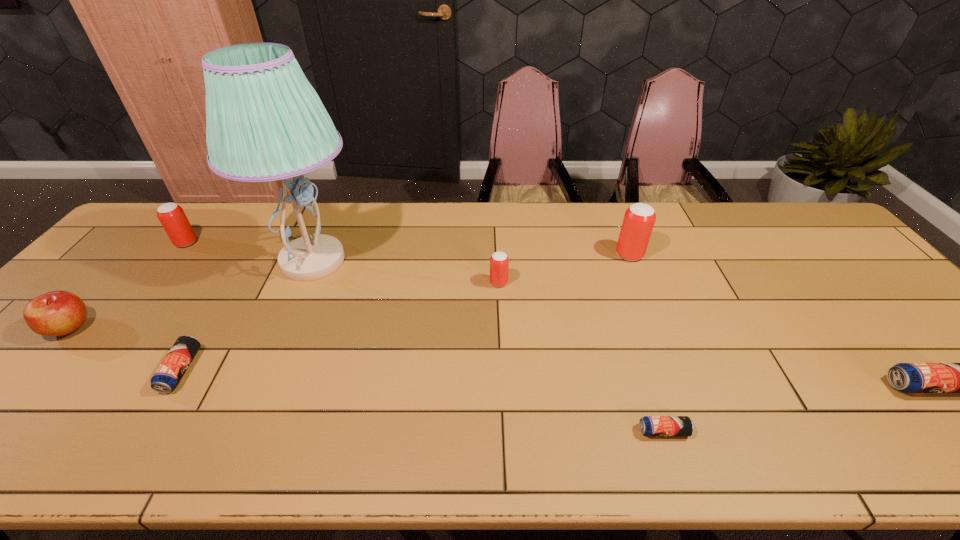
Where is `the second beer can from left to right`? This screenshot has width=960, height=540. the second beer can from left to right is located at coordinates (168, 375).

The width and height of the screenshot is (960, 540). I want to click on the leftmost blue beer can, so point(168,375).

Where is `the nearest object`? the nearest object is located at coordinates (649, 425).

Image resolution: width=960 pixels, height=540 pixels. I want to click on the nearest blue beer can, so click(649, 425).

Locate an element on the screen. Image resolution: width=960 pixels, height=540 pixels. vacant space located 0.290m on the right of the fifth object from right to left is located at coordinates (463, 261).

Locate an element on the screen. This screenshot has height=540, width=960. free space located 0.210m on the right of the seventh shortest object is located at coordinates (713, 255).

The height and width of the screenshot is (540, 960). I want to click on vacant space located on the back of the seventh object from right to left, so click(202, 224).

What are the coordinates of `free space located 0.350m on the right of the leftmost object` in the screenshot? It's located at (230, 328).

Locate an element on the screen. This screenshot has width=960, height=540. vacant space situated on the back of the nearest red beer can is located at coordinates (496, 224).

Locate an element on the screen. free location located 0.160m on the right of the leftmost blue beer can is located at coordinates (262, 370).